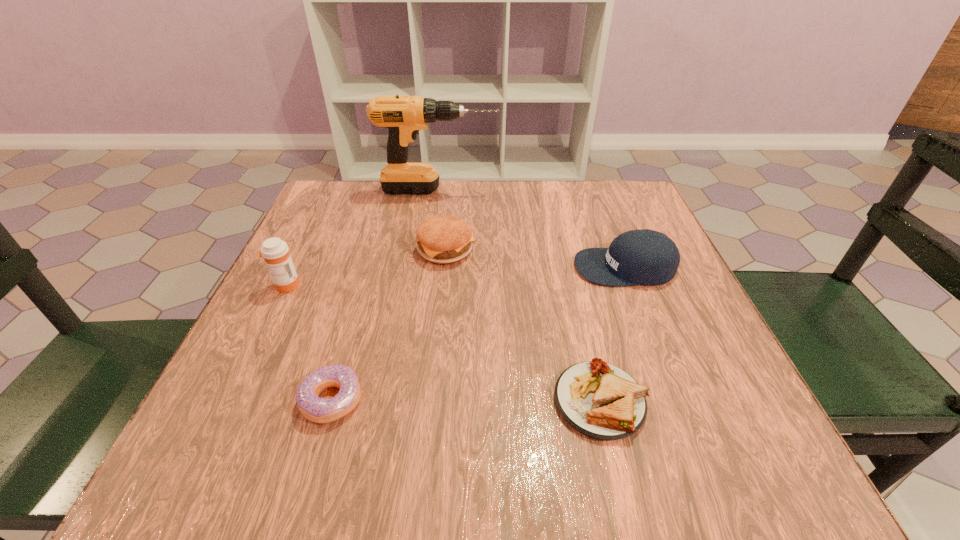
The height and width of the screenshot is (540, 960). In order to click on medicine that is at the left edge in this screenshot , I will do `click(275, 252)`.

The width and height of the screenshot is (960, 540). In order to click on doughnut situated at the left edge in this screenshot , I will do `click(319, 410)`.

This screenshot has height=540, width=960. I want to click on baseball cap situated at the right edge, so click(x=637, y=257).

Find the location of a particular element. sandwich positioned at the right edge is located at coordinates (601, 401).

At what (x,y) coordinates should I click in order to perform the action: click on object that is at the far left corner. Please return your answer as a coordinate pair (x, y). The image size is (960, 540). Looking at the image, I should click on (404, 116).

At what (x,y) coordinates should I click in order to perform the action: click on object located at the near left corner. Please return your answer as a coordinate pair (x, y). Looking at the image, I should click on (319, 410).

At what (x,y) coordinates should I click in order to perform the action: click on object situated at the near right corner. Please return your answer as a coordinate pair (x, y). The image size is (960, 540). Looking at the image, I should click on (601, 401).

The width and height of the screenshot is (960, 540). What are the coordinates of `vacant space at the far edge of the desktop` in the screenshot? It's located at (467, 185).

I want to click on vacant space at the near edge, so click(496, 432).

Locate an element on the screen. The width and height of the screenshot is (960, 540). free space at the left edge of the desktop is located at coordinates (297, 291).